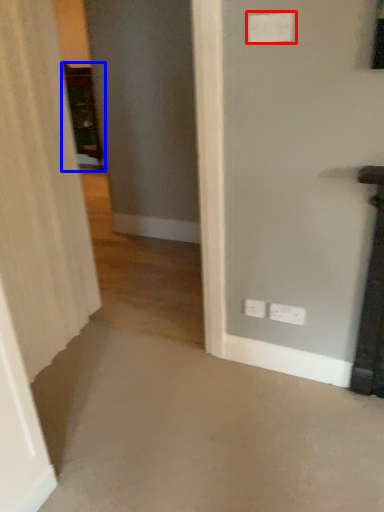
Question: Among these objects, which one is nearest to the camera, electric outlet (highlighted by a red box) or furniture (highlighted by a blue box)?

Choices:
 (A) electric outlet
 (B) furniture

Answer: (A)